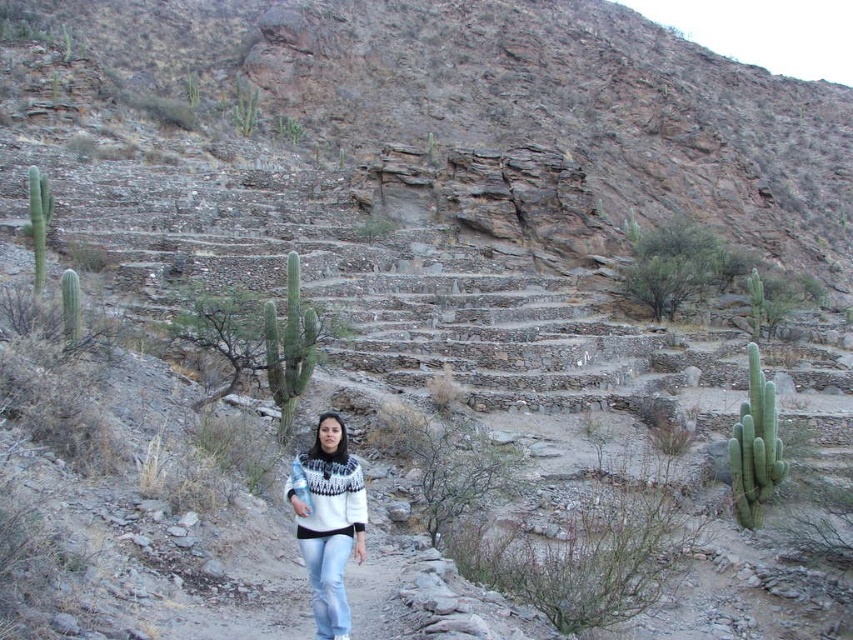
Question: Is white knit sweater at center thinner than green spiny cactus at center?

Choices:
 (A) yes
 (B) no

Answer: (A)

Question: Which point appears closest to the camera in this image?

Choices:
 (A) (352, 467)
 (B) (260, 20)
 (C) (749, 371)
 (D) (350, 532)

Answer: (D)

Question: Can you confirm if brown rocky hillside at upper center is positioned to the left of white knit sweater at center?

Choices:
 (A) yes
 (B) no

Answer: (B)

Question: Does light blue denim jeans at center appear on the right side of green spiny cactus at left?

Choices:
 (A) yes
 (B) no

Answer: (A)

Question: Which object appears closest to the camera in this image?

Choices:
 (A) brown rocky hillside at upper center
 (B) light blue denim jeans at center

Answer: (B)

Question: Which point is closer to the camera?

Choices:
 (A) white knitwear at center
 (B) green spiny cactus at left
 (C) green spiny cactus at center
 (D) brown rocky hillside at upper center

Answer: (A)